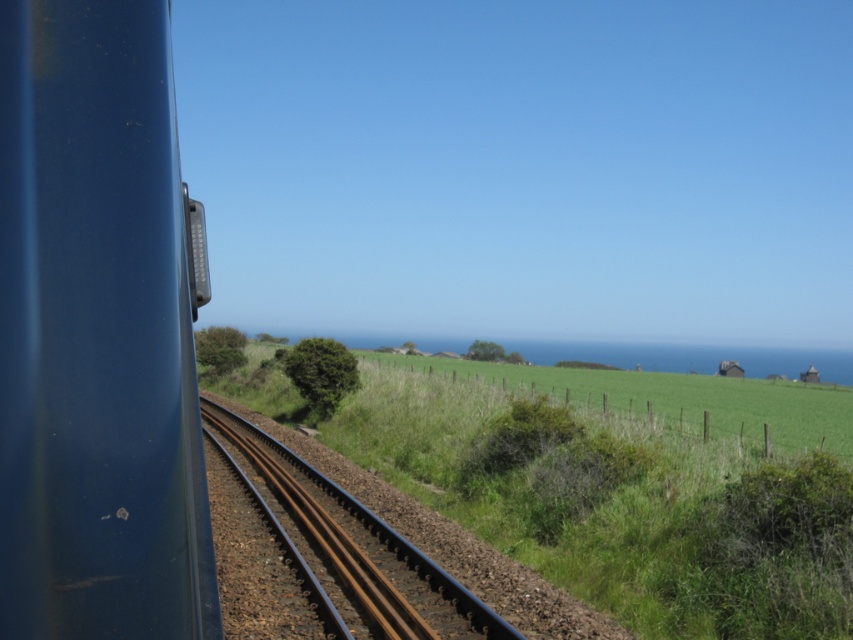
Question: Is green grassy at center closer to camera compared to brown metal track at center?

Choices:
 (A) yes
 (B) no

Answer: (A)

Question: Which point appears closest to the camera in this image?

Choices:
 (A) (584, 506)
 (B) (178, 608)
 (C) (231, 461)

Answer: (B)

Question: Which of these objects is positioned closest to the brown metal track at center?

Choices:
 (A) green grassy at center
 (B) matte blue train at left

Answer: (B)

Question: Does matte blue train at left lie behind green grassy at center?

Choices:
 (A) no
 (B) yes

Answer: (A)

Question: Does matte blue train at left have a larger size compared to brown metal track at center?

Choices:
 (A) yes
 (B) no

Answer: (B)

Question: Estimate the real-world distances between objects in this image. Which object is farther from the matte blue train at left?

Choices:
 (A) green grassy at center
 (B) brown metal track at center

Answer: (A)